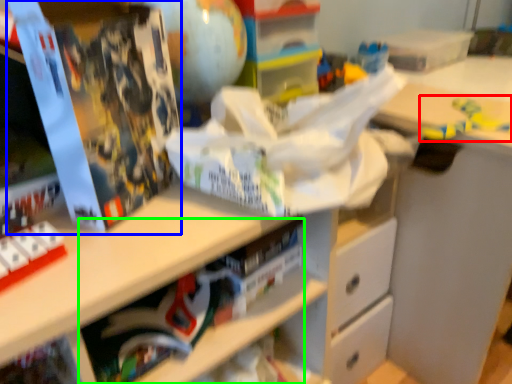
Question: Which object is the farthest from toy (highlighted by a red box)? Choose among these: paperback book (highlighted by a blue box) or book (highlighted by a green box).

Choices:
 (A) paperback book
 (B) book

Answer: (A)